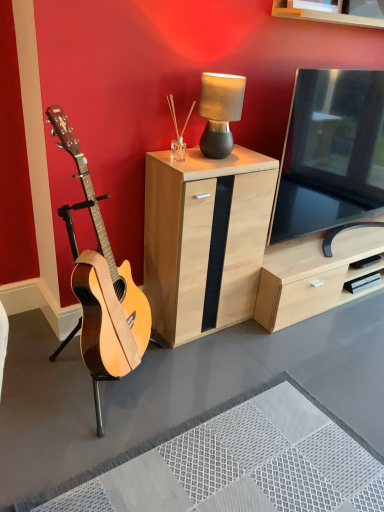
Find the location of a particular element. The width and height of the screenshot is (384, 512). matte black lamp at upper center is located at coordinates (220, 112).

Image resolution: width=384 pixels, height=512 pixels. Describe the element at coordinates (220, 112) in the screenshot. I see `matte black lamp at upper center` at that location.

What are the coordinates of `black glossy tv at right` in the screenshot? It's located at (330, 152).

Would you say natural wood guitar at left is outside matte black lamp at upper center?

Yes.

Is natural wood guitar at left turned away from matte black lamp at upper center?

natural wood guitar at left is not turned away from matte black lamp at upper center.

Which object is further away from the camera, natural wood guitar at left or matte black lamp at upper center?

matte black lamp at upper center is more distant.

Which of these two, natural wood guitar at left or matte black lamp at upper center, is bigger?

natural wood guitar at left.

Considering the relative positions of matte black lamp at upper center and natural wood guitar at left in the image provided, is matte black lamp at upper center behind natural wood guitar at left?

Yes, matte black lamp at upper center is further from the camera.

From the image's perspective, which is below, matte black lamp at upper center or natural wood guitar at left?

From the image's view, natural wood guitar at left is below.

Would you say matte black lamp at upper center is to the left or to the right of natural wood guitar at left in the picture?

Based on their positions, matte black lamp at upper center is located to the right of natural wood guitar at left.

Would you say natural wood guitar at left is part of matte black lamp at upper center's contents?

No.

Looking at this image, which of these two, light wood/black panel cabinet at center or black glossy tv at right, is smaller?

light wood/black panel cabinet at center is smaller.

Considering the relative positions of light wood/black panel cabinet at center and black glossy tv at right in the image provided, is light wood/black panel cabinet at center behind black glossy tv at right?

No, light wood/black panel cabinet at center is in front of black glossy tv at right.

Is light wood/black panel cabinet at center next to black glossy tv at right?

No.

From the image's perspective, relative to black glossy tv at right, is light wood/black panel cabinet at center above or below?

Based on their image positions, light wood/black panel cabinet at center is located beneath black glossy tv at right.

The height and width of the screenshot is (512, 384). Find the location of `television beneath the matte black lamp at upper center (from a real-world perspective)`. television beneath the matte black lamp at upper center (from a real-world perspective) is located at coordinates (330, 152).

Can you tell me how much black glossy tv at right and matte black lamp at upper center differ in facing direction?

The angle between the facing direction of black glossy tv at right and the facing direction of matte black lamp at upper center is 3.35 degrees.

Is matte black lamp at upper center a part of black glossy tv at right?

Definitely not — matte black lamp at upper center is not inside black glossy tv at right.

Considering the sizes of objects black glossy tv at right and matte black lamp at upper center in the image provided, who is bigger, black glossy tv at right or matte black lamp at upper center?

black glossy tv at right is bigger.

Between light wood/black panel cabinet at center and natural wood guitar at left, which one has less height?

Standing shorter between the two is light wood/black panel cabinet at center.

Is light wood/black panel cabinet at center oriented away from natural wood guitar at left?

No, light wood/black panel cabinet at center is not facing the opposite direction of natural wood guitar at left.

From a real-world perspective, is light wood/black panel cabinet at center physically located above or below natural wood guitar at left?

light wood/black panel cabinet at center is below natural wood guitar at left.

Where is `guitar above the light wood/black panel cabinet at center (from a real-world perspective)`? The height and width of the screenshot is (512, 384). guitar above the light wood/black panel cabinet at center (from a real-world perspective) is located at coordinates (101, 282).

Is matte black lamp at upper center behind light wood/black panel cabinet at center?

Yes, the depth of matte black lamp at upper center is greater than that of light wood/black panel cabinet at center.

From the image's perspective, is matte black lamp at upper center on top of light wood/black panel cabinet at center?

Yes, from the image's perspective, matte black lamp at upper center is on top of light wood/black panel cabinet at center.

Based on their sizes in the image, would you say matte black lamp at upper center is bigger or smaller than light wood/black panel cabinet at center?

In the image, matte black lamp at upper center appears to be smaller than light wood/black panel cabinet at center.

Based on the photo, does black glossy tv at right have a greater width compared to light wood/black panel cabinet at center?

No.

Is black glossy tv at right to the right of light wood/black panel cabinet at center from the viewer's perspective?

Yes, black glossy tv at right is to the right of light wood/black panel cabinet at center.

Is point (296, 85) closer or farther from the camera than point (270, 205)?

Point (296, 85) appears to be closer to the viewer than point (270, 205).

The width and height of the screenshot is (384, 512). Identify the location of guitar that appears on the left of matte black lamp at upper center. click(101, 282).

Identify the location of lamp above the natural wood guitar at left (from a real-world perspective). (220, 112).

When comparing their distances from black glossy tv at right, does matte black lamp at upper center or light wood/black panel cabinet at center seem closer?

light wood/black panel cabinet at center is positioned closer to the anchor black glossy tv at right.

When comparing their distances from matte black lamp at upper center, does black glossy tv at right or light wood/black panel cabinet at center seem closer?

light wood/black panel cabinet at center is positioned closer to the anchor matte black lamp at upper center.

When comparing their distances from light wood/black panel cabinet at center, does matte black lamp at upper center or black glossy tv at right seem closer?

The object closer to light wood/black panel cabinet at center is matte black lamp at upper center.

Looking at the image, which one is located further to light wood/black panel cabinet at center, black glossy tv at right or natural wood guitar at left?

The object further to light wood/black panel cabinet at center is black glossy tv at right.

When comparing their distances from natural wood guitar at left, does matte black lamp at upper center or light wood/black panel cabinet at center seem further?

The object further to natural wood guitar at left is matte black lamp at upper center.

Estimate the real-world distances between objects in this image. Which object is closer to natural wood guitar at left, matte black lamp at upper center or black glossy tv at right?

Among the two, matte black lamp at upper center is located nearer to natural wood guitar at left.

From the image, which object appears to be farther from matte black lamp at upper center, light wood/black panel cabinet at center or black glossy tv at right?

black glossy tv at right is further to matte black lamp at upper center.

Based on the photo, considering their positions, is black glossy tv at right positioned further to natural wood guitar at left than matte black lamp at upper center?

black glossy tv at right.

You are a GUI agent. You are given a task and a screenshot of the screen. Output one action in this format:
    pyautogui.click(x=<x>, y=<y>)
    Task: Click on the cabinetry between matte black lamp at upper center and natural wood guitar at left from top to bottom
    
    Given the screenshot: What is the action you would take?
    point(205,238)

You are a GUI agent. You are given a task and a screenshot of the screen. Output one action in this format:
    pyautogui.click(x=<x>, y=<y>)
    Task: Click on the cabinetry between natural wood guitar at left and black glossy tv at right from left to right
    This screenshot has width=384, height=512.
    Given the screenshot: What is the action you would take?
    [x=205, y=238]

This screenshot has width=384, height=512. Find the location of `lamp between light wood/black panel cabinet at center and black glossy tv at right`. lamp between light wood/black panel cabinet at center and black glossy tv at right is located at coordinates coord(220,112).

Identify the location of lamp between natural wood guitar at left and black glossy tv at right from left to right. (220, 112).